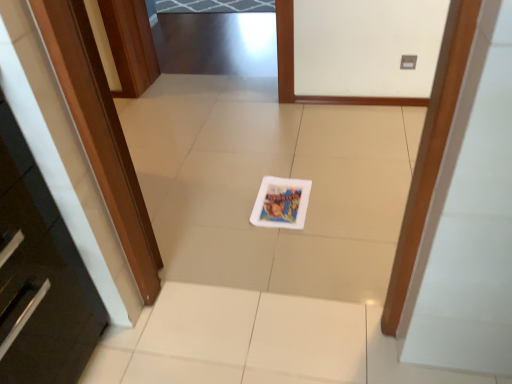
This screenshot has height=384, width=512. Identify the location of vacant space to the right of wooden door at left. 230,209.